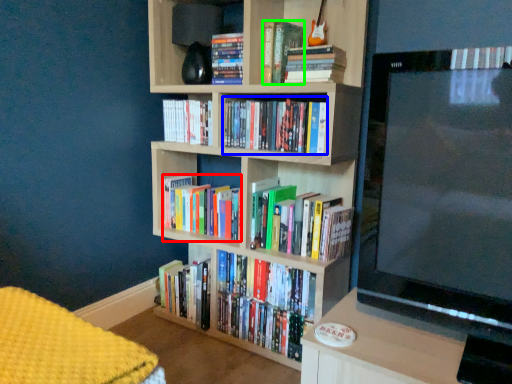
Question: Which object is the closest to the book (highlighted by a red box)? Choose among these: book (highlighted by a blue box) or book (highlighted by a green box).

Choices:
 (A) book
 (B) book

Answer: (A)